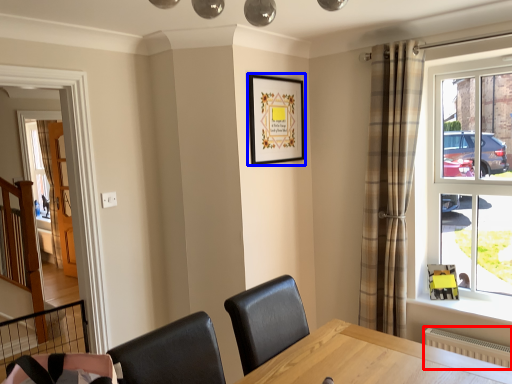
Question: Which point is further to the camera, radiator (highlighted by a red box) or picture frame (highlighted by a blue box)?

Choices:
 (A) radiator
 (B) picture frame

Answer: (B)